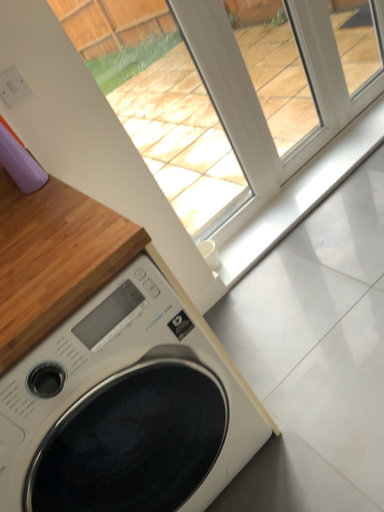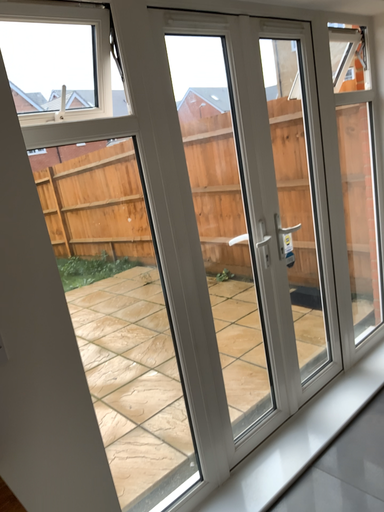
Question: How did the camera likely rotate when shooting the video?

Choices:
 (A) rotated downward
 (B) rotated upward

Answer: (B)